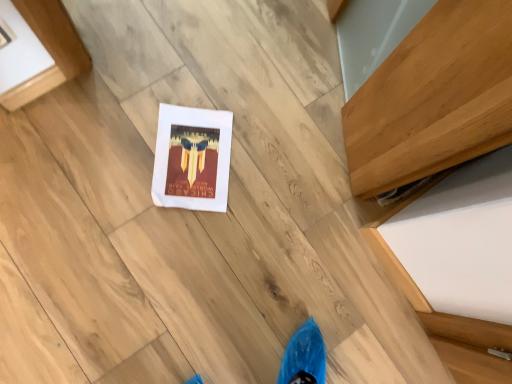
Where is `free space above white paper at center (from a real-world perspective)`? This screenshot has height=384, width=512. free space above white paper at center (from a real-world perspective) is located at coordinates (192, 156).